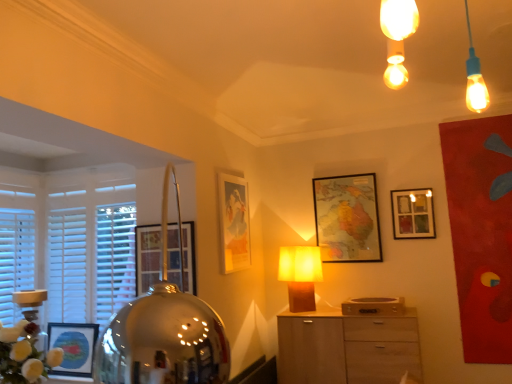
Question: Is white wooden blinds at left completely or partially outside of matte glass picture frame at upper right, which is the 1th picture frame from right to left?

Choices:
 (A) yes
 (B) no

Answer: (A)

Question: Does white wooden blinds at left have a greater height compared to matte glass picture frame at upper right, the 4th picture frame in the left-to-right sequence?

Choices:
 (A) no
 (B) yes

Answer: (B)

Question: From the image's perspective, is white wooden blinds at left under matte glass picture frame at upper right, which is the 1th picture frame from right to left?

Choices:
 (A) no
 (B) yes

Answer: (B)

Question: Considering the relative positions of white wooden blinds at left and matte glass picture frame at upper right, the 4th picture frame in the left-to-right sequence, in the image provided, is white wooden blinds at left to the left of matte glass picture frame at upper right, the 4th picture frame in the left-to-right sequence, from the viewer's perspective?

Choices:
 (A) no
 (B) yes

Answer: (B)

Question: From a real-world perspective, is white wooden blinds at left located beneath matte glass picture frame at upper right, which is the 1th picture frame from right to left?

Choices:
 (A) no
 (B) yes

Answer: (B)

Question: In the image, is wooden map at center, which appears as the third picture frame when viewed from the left, positioned in front of or behind matte glass picture frame at upper right, which is the 1th picture frame from right to left?

Choices:
 (A) behind
 (B) front

Answer: (A)

Question: In terms of height, does wooden map at center, which appears as the third picture frame when viewed from the left, look taller or shorter compared to matte glass picture frame at upper right, the 4th picture frame in the left-to-right sequence?

Choices:
 (A) short
 (B) tall

Answer: (B)

Question: From a real-world perspective, is wooden map at center, which appears as the 2th picture frame when viewed from the right, positioned above or below matte glass picture frame at upper right, which is the 1th picture frame from right to left?

Choices:
 (A) above
 (B) below

Answer: (A)

Question: Would you say wooden map at center, which appears as the 2th picture frame when viewed from the right, is inside or outside matte glass picture frame at upper right, which is the 1th picture frame from right to left?

Choices:
 (A) outside
 (B) inside

Answer: (A)

Question: Is matte glass picture frame at left, the 1th picture frame when ordered from left to right, in front of or behind matte yellow fabric lampshade at center in the image?

Choices:
 (A) behind
 (B) front

Answer: (B)

Question: Do you think matte glass picture frame at left, acting as the 4th picture frame starting from the right, is within matte yellow fabric lampshade at center, or outside of it?

Choices:
 (A) outside
 (B) inside

Answer: (A)

Question: In terms of size, does matte glass picture frame at left, acting as the 4th picture frame starting from the right, appear bigger or smaller than matte yellow fabric lampshade at center?

Choices:
 (A) big
 (B) small

Answer: (B)

Question: In terms of width, does matte glass picture frame at left, the 1th picture frame when ordered from left to right, look wider or thinner when compared to matte yellow fabric lampshade at center?

Choices:
 (A) wide
 (B) thin

Answer: (B)

Question: In terms of width, does matte glass picture frame at upper right, which is the 1th picture frame from right to left, look wider or thinner when compared to light wood cabinet at center?

Choices:
 (A) wide
 (B) thin

Answer: (B)

Question: Is matte glass picture frame at upper right, the 4th picture frame in the left-to-right sequence, in front of or behind light wood cabinet at center in the image?

Choices:
 (A) front
 (B) behind

Answer: (B)